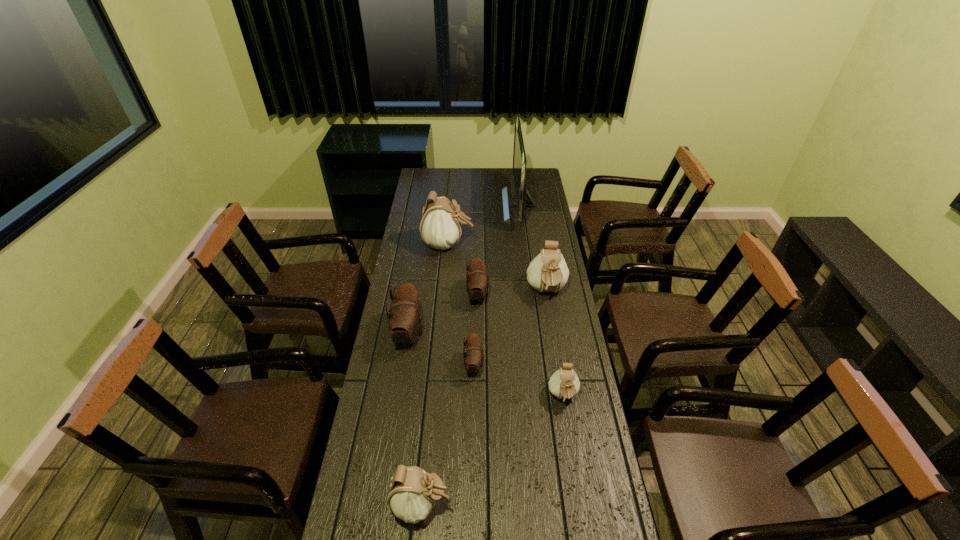
Where is `brown pouch that can be found as the third closest to the smallest white pouch`? brown pouch that can be found as the third closest to the smallest white pouch is located at coordinates (404, 318).

The image size is (960, 540). Identify the location of vacant region that satisfies the following two spatial constraints: 1. on the front-facing side of the smallest white pouch; 2. on the front-facing side of the nearest object. (581, 504).